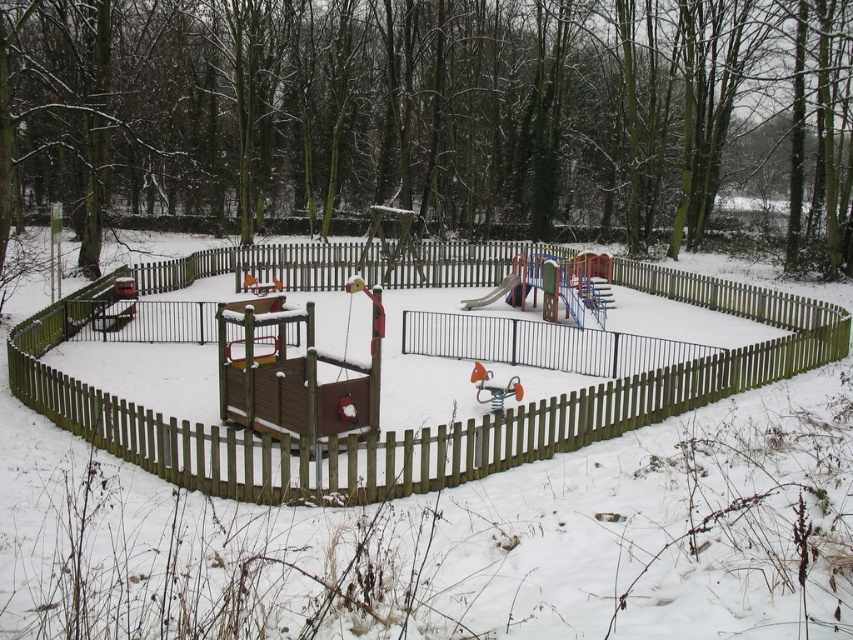
The width and height of the screenshot is (853, 640). I want to click on brown wooden fence at center, so click(379, 392).

Does point (596, 433) come behind point (515, 275)?

No, it is not.

At what (x,y) coordinates should I click in order to perform the action: click on brown wooden fence at center. Please return your answer as a coordinate pair (x, y). This screenshot has height=640, width=853. Looking at the image, I should click on (379, 392).